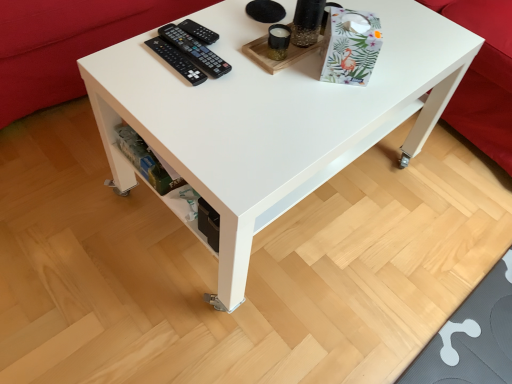
You are a GUI agent. You are given a task and a screenshot of the screen. Output one action in this format:
    pyautogui.click(x=<x>, y=<y>)
    Task: Click on the free space behind black plastic remote controls at upper left, the second control in the top-to-bottom sequence
    The height and width of the screenshot is (384, 512).
    Given the screenshot: What is the action you would take?
    pyautogui.click(x=218, y=24)